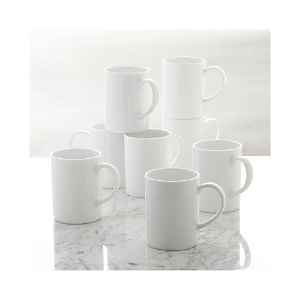
Find the location of `white mugs`. white mugs is located at coordinates (67, 177), (107, 139), (126, 103), (149, 150), (189, 85), (189, 140), (216, 163), (166, 202).